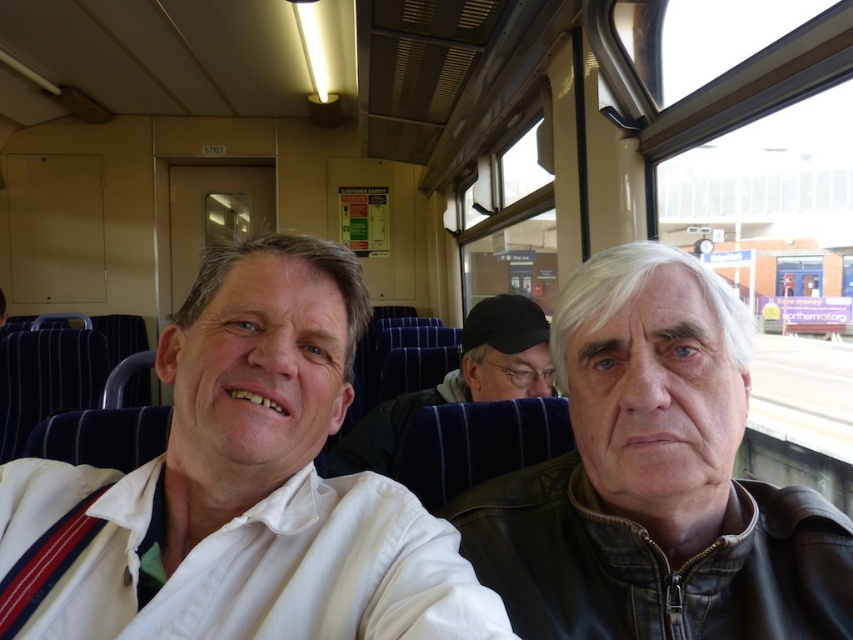
Question: Considering the real-world distances, which object is closest to the white shirt at center?

Choices:
 (A) leather jacket at right
 (B) dark blue fabric jacket at center

Answer: (A)

Question: Which object appears closest to the camera in this image?

Choices:
 (A) leather jacket at right
 (B) dark blue fabric jacket at center
 (C) white shirt at center

Answer: (C)

Question: Is white shirt at center further to camera compared to dark blue fabric jacket at center?

Choices:
 (A) no
 (B) yes

Answer: (A)

Question: Is white shirt at center positioned behind dark blue fabric jacket at center?

Choices:
 (A) yes
 (B) no

Answer: (B)

Question: Is leather jacket at right bigger than dark blue fabric jacket at center?

Choices:
 (A) yes
 (B) no

Answer: (B)

Question: Estimate the real-world distances between objects in this image. Which object is closer to the dark blue fabric jacket at center?

Choices:
 (A) leather jacket at right
 (B) white shirt at center

Answer: (A)